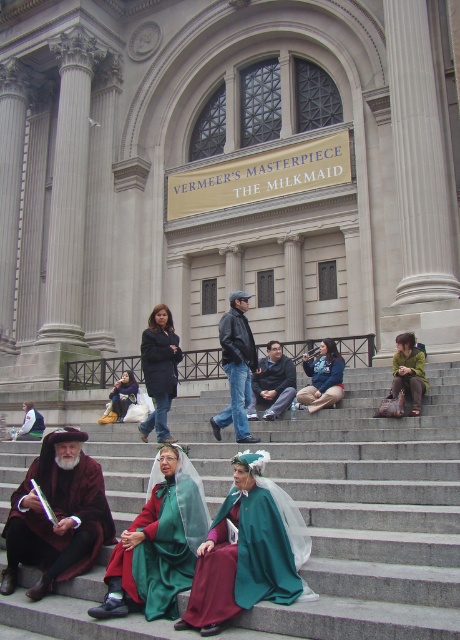
You are standing in front of the grand building and want to walk from point [157,333] to point [339,380]. Which direction should you move in relation to the building?

You should move away from the building because point [157,333] is closer to you than point [339,380].

You are standing at the entrance of the grand building and want to walk to the point marked as point (x=257, y=474). If you continue moving forward in a straight line, will you pass by point (x=362, y=449) before reaching your destination?

No, because point (x=362, y=449) is behind point (x=257, y=474), so moving forward towards the latter, you would reach point (x=257, y=474) first without passing point (x=362, y=449).